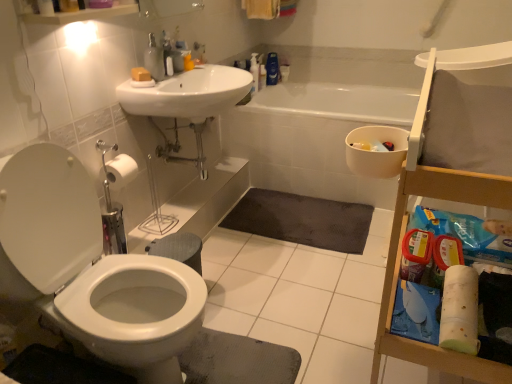
Question: In the image, is white glossy toilet at left positioned in front of or behind white glossy sink at upper center?

Choices:
 (A) behind
 (B) front

Answer: (B)

Question: Considering the positions of white glossy toilet at left and white glossy sink at upper center in the image, is white glossy toilet at left wider or thinner than white glossy sink at upper center?

Choices:
 (A) thin
 (B) wide

Answer: (B)

Question: Which is nearer to the white glossy sink at upper center?

Choices:
 (A) translucent plastic bottle at upper center, the 2th toiletry in the bottom-to-top sequence
 (B) white glossy toilet at left
 (C) dark gray textured bath mat at center
 (D) yellow matte soap at upper center
 (E) metallic silver pipes at center

Answer: (D)

Question: Estimate the real-world distances between objects in this image. Which object is closer to the white glossy sink at upper center?

Choices:
 (A) white textured towel at lower right
 (B) metallic silver pipes at center
 (C) yellow matte soap at upper center
 (D) translucent plastic bottle at upper center, the 2th cleaning product viewed from the right
 (E) blue glossy bottle at upper center, positioned as the first cleaning product in right-to-left order

Answer: (C)